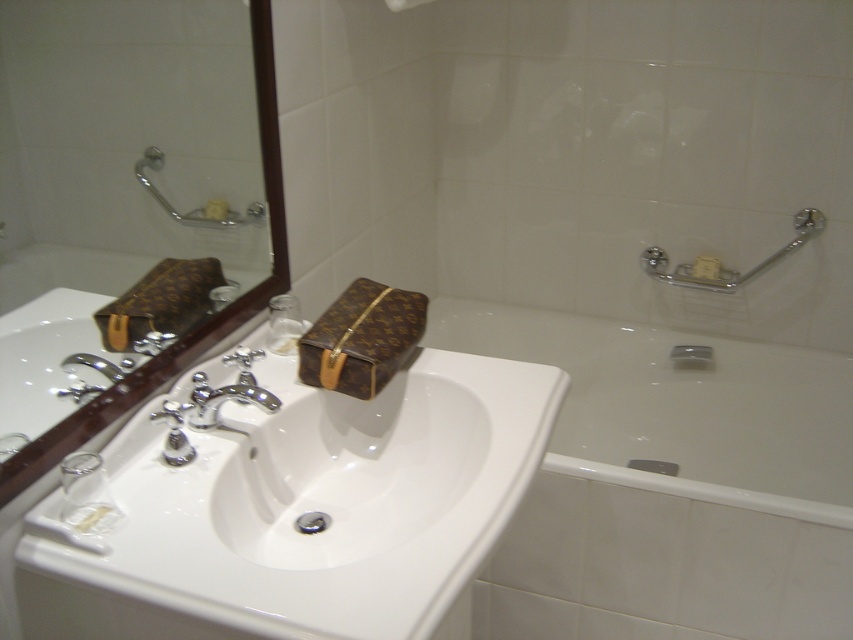
Does white glossy sink at center have a smaller size compared to brown leather mirror at upper left?

No, white glossy sink at center is not smaller than brown leather mirror at upper left.

Describe the element at coordinates (300, 509) in the screenshot. I see `white glossy sink at center` at that location.

Where is `white glossy sink at center`? This screenshot has height=640, width=853. white glossy sink at center is located at coordinates 300,509.

Is white glossy bathtub at lower right smaller than yellow matte soap at upper center?

No, white glossy bathtub at lower right is not smaller than yellow matte soap at upper center.

Is white glossy bathtub at lower right to the right of yellow matte soap at upper center from the viewer's perspective?

Indeed, white glossy bathtub at lower right is positioned on the right side of yellow matte soap at upper center.

Who is more distant from viewer, [569,328] or [216,198]?

Positioned behind is point [569,328].

Find the location of a particular element. The image size is (853, 640). white glossy bathtub at lower right is located at coordinates tap(670, 484).

Who is shorter, yellow matte soap at upper center or matte brown towel bar at upper center?

Standing shorter between the two is yellow matte soap at upper center.

Where is `yellow matte soap at upper center`? The height and width of the screenshot is (640, 853). yellow matte soap at upper center is located at coordinates (215, 209).